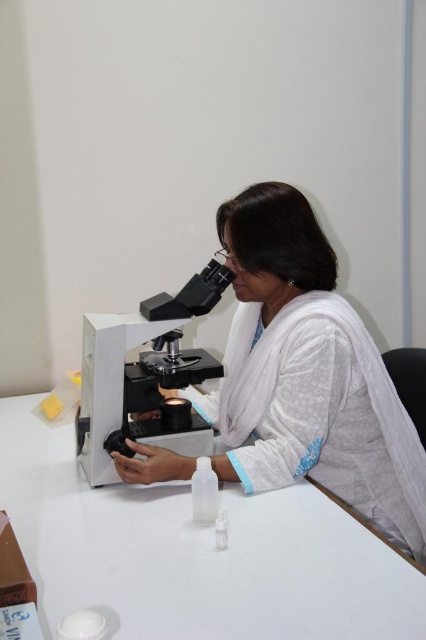
Question: From the image, what is the correct spatial relationship of white plastic table at center in relation to white plastic microscope at center?

Choices:
 (A) below
 (B) above

Answer: (A)

Question: Which object is farther from the camera taking this photo?

Choices:
 (A) white plastic microscope at center
 (B) white plastic table at center
 (C) white matte/soft fabric at center

Answer: (A)

Question: Can you confirm if white matte/soft fabric at center is positioned above white plastic microscope at center?

Choices:
 (A) yes
 (B) no

Answer: (B)

Question: Which point appears closest to the camera in this image?

Choices:
 (A) (325, 497)
 (B) (393, 440)

Answer: (A)

Question: Among these objects, which one is nearest to the camera?

Choices:
 (A) white plastic microscope at center
 (B) white matte/soft fabric at center
 (C) white plastic table at center

Answer: (C)

Question: Is white plastic table at center to the right of white plastic microscope at center from the viewer's perspective?

Choices:
 (A) yes
 (B) no

Answer: (B)